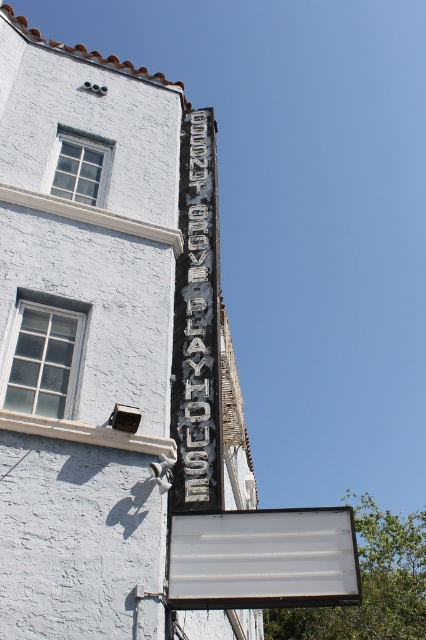
Question: Can you confirm if white matte sign at center is wider than black metal sign at upper center?

Choices:
 (A) yes
 (B) no

Answer: (A)

Question: Which point is farther to the camera?

Choices:
 (A) (189, 324)
 (B) (291, 516)

Answer: (A)

Question: Is white matte sign at center above black metal sign at upper center?

Choices:
 (A) yes
 (B) no

Answer: (B)

Question: Which point appears closest to the camera in this image?

Choices:
 (A) (184, 170)
 (B) (316, 529)

Answer: (B)

Question: Is white matte sign at center thinner than black metal sign at upper center?

Choices:
 (A) yes
 (B) no

Answer: (B)